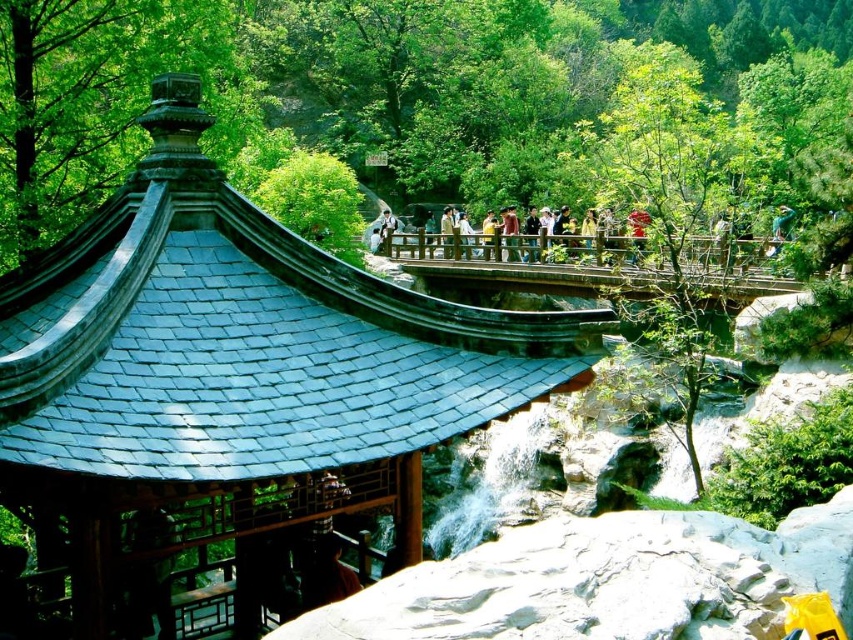
You are standing in the pavilion and want to take a photo of the shiny dark blue roof at center and the red fabric person at center. Which object should you point your camera towards first to capture both in the same frame?

You should point your camera towards the shiny dark blue roof at center first because it is below the red fabric person at center, so adjusting the angle to include both would require framing from the lower part upwards.

You are standing at the entrance of the pavilion and want to cross to the other side of the river. The brown wooden bridge at center and the red fabric person at center are in your path. Which object should you move around to reach the bridge first?

You should move around the red fabric person at center first because the brown wooden bridge at center is to the left of the red fabric person at center, meaning the person is blocking the path to the bridge.